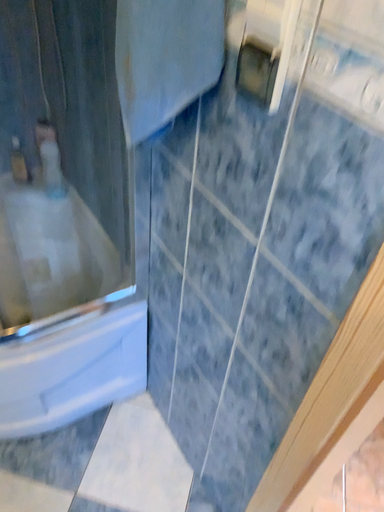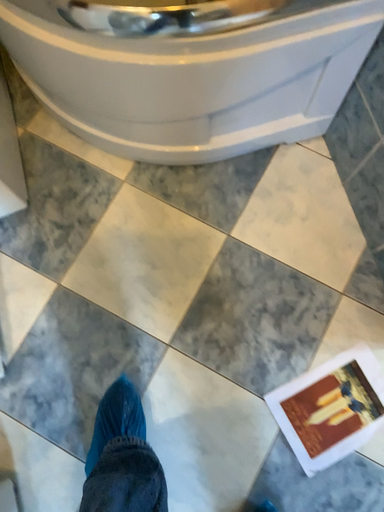
Question: How did the camera likely rotate when shooting the video?

Choices:
 (A) rotated left
 (B) rotated right

Answer: (A)